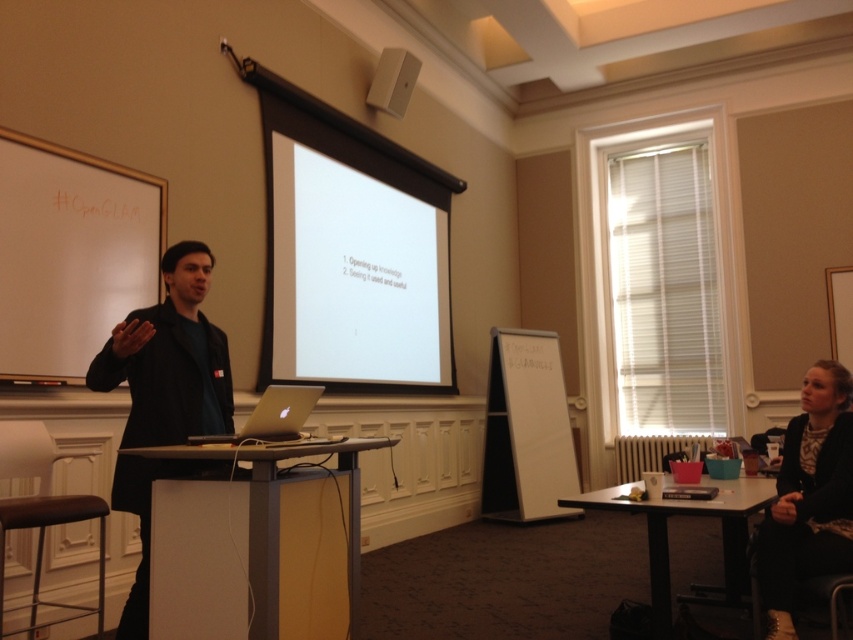
Question: Which object is the farthest from the black textured sweater at lower right?

Choices:
 (A) white glossy table at center
 (B) white matte projection screen at center
 (C) silver metallic laptop at center
 (D) black matte jacket at center

Answer: (B)

Question: Is white glossy table at center thinner than black textured sweater at lower right?

Choices:
 (A) no
 (B) yes

Answer: (A)

Question: Among these points, which one is farthest from the camera?

Choices:
 (A) (113, 326)
 (B) (281, 429)
 (C) (231, 596)
 (D) (651, 576)

Answer: (D)

Question: Does white glossy table at center have a larger size compared to silver metallic laptop at center?

Choices:
 (A) no
 (B) yes

Answer: (B)

Question: Which of the following is the farthest from the observer?

Choices:
 (A) white glossy table at center
 (B) white matte projection screen at center
 (C) silver metallic laptop at center

Answer: (B)

Question: Observing the image, what is the correct spatial positioning of black matte jacket at center in reference to white plastic speaker at upper center?

Choices:
 (A) right
 (B) left

Answer: (B)